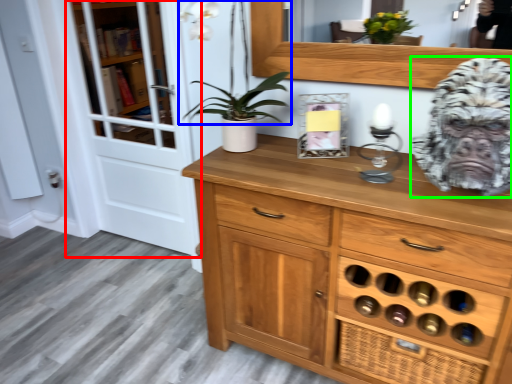
Question: Considering the real-world distances, which object is closest to screen door (highlighted by a red box)? plant (highlighted by a blue box) or gorilla (highlighted by a green box).

Choices:
 (A) plant
 (B) gorilla

Answer: (A)